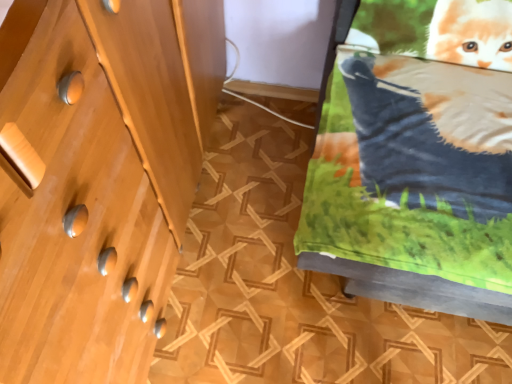
Where is `printed cotton blanket at right`? This screenshot has width=512, height=384. printed cotton blanket at right is located at coordinates (414, 169).

Describe the element at coordinates (414, 169) in the screenshot. I see `printed cotton blanket at right` at that location.

Find the location of a particular element. Image resolution: width=512 pixels, height=384 pixels. printed cotton blanket at right is located at coordinates (414, 169).